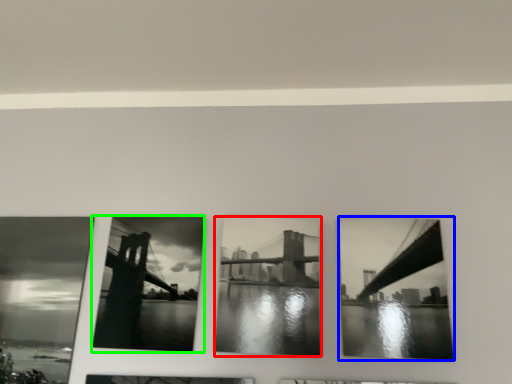
Question: Considering the real-world distances, which object is farthest from picture frame (highlighted by a red box)? picture frame (highlighted by a blue box) or picture frame (highlighted by a green box)?

Choices:
 (A) picture frame
 (B) picture frame

Answer: (A)